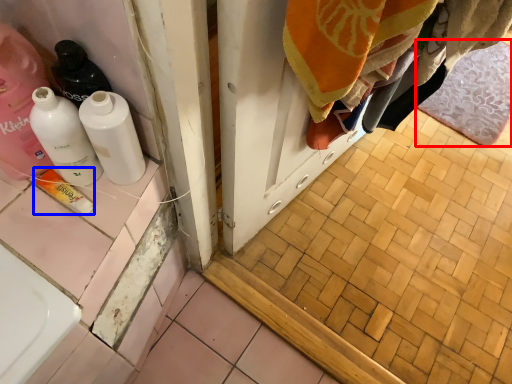
Question: Which of the following is the farthest to the observer, bath mat (highlighted by a red box) or product (highlighted by a blue box)?

Choices:
 (A) bath mat
 (B) product

Answer: (A)